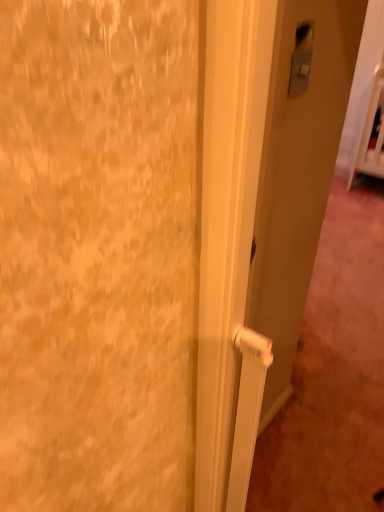
Question: In the image, is satin silver switch at upper right on the left side or the right side of white plastic door handle at center?

Choices:
 (A) right
 (B) left

Answer: (B)

Question: Is satin silver switch at upper right in front of or behind white plastic door handle at center in the image?

Choices:
 (A) front
 (B) behind

Answer: (B)

Question: Does point (301, 86) appear closer or farther from the camera than point (281, 356)?

Choices:
 (A) closer
 (B) farther

Answer: (A)

Question: From a real-world perspective, is white plastic door handle at center positioned above or below satin silver switch at upper right?

Choices:
 (A) above
 (B) below

Answer: (B)

Question: Is white plastic door handle at center in front of or behind satin silver switch at upper right in the image?

Choices:
 (A) behind
 (B) front

Answer: (B)

Question: From the image's perspective, relative to satin silver switch at upper right, is white plastic door handle at center above or below?

Choices:
 (A) above
 (B) below

Answer: (B)

Question: Considering the positions of white plastic door handle at center and satin silver switch at upper right in the image, is white plastic door handle at center taller or shorter than satin silver switch at upper right?

Choices:
 (A) short
 (B) tall

Answer: (B)